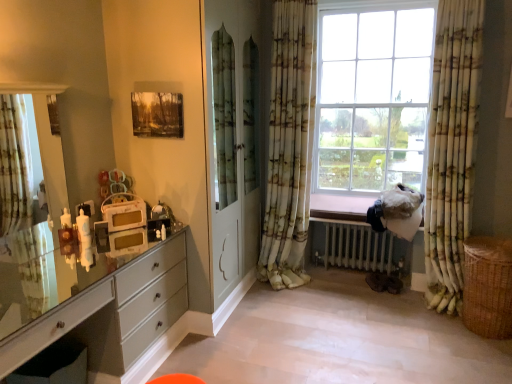
Question: In terms of width, does braided wicker basket at lower right look wider or thinner when compared to green and white textured curtain at right, placed as the 3th curtain when sorted from left to right?

Choices:
 (A) thin
 (B) wide

Answer: (B)

Question: In terms of size, does braided wicker basket at lower right appear bigger or smaller than green and white textured curtain at right, which is counted as the first curtain, starting from the right?

Choices:
 (A) small
 (B) big

Answer: (A)

Question: Which of these objects is positioned farthest from the green and white floral curtain at center, which is the 2th curtain in left-to-right order?

Choices:
 (A) green floral curtain at left, which appears as the 3th curtain when viewed from the right
 (B) white metallic radiator at lower right
 (C) matte wooden picture frame at upper center
 (D) matte white clock at left
 (E) braided wicker basket at lower right

Answer: (A)

Question: Estimate the real-world distances between objects in this image. Which object is closer to the matte white clock at left?

Choices:
 (A) green and white textured curtain at right, placed as the 3th curtain when sorted from left to right
 (B) white glossy chest of drawers at lower left
 (C) green floral curtain at left, which is the 1th curtain from left to right
 (D) matte wooden picture frame at upper center
 (E) white metallic radiator at lower right

Answer: (B)